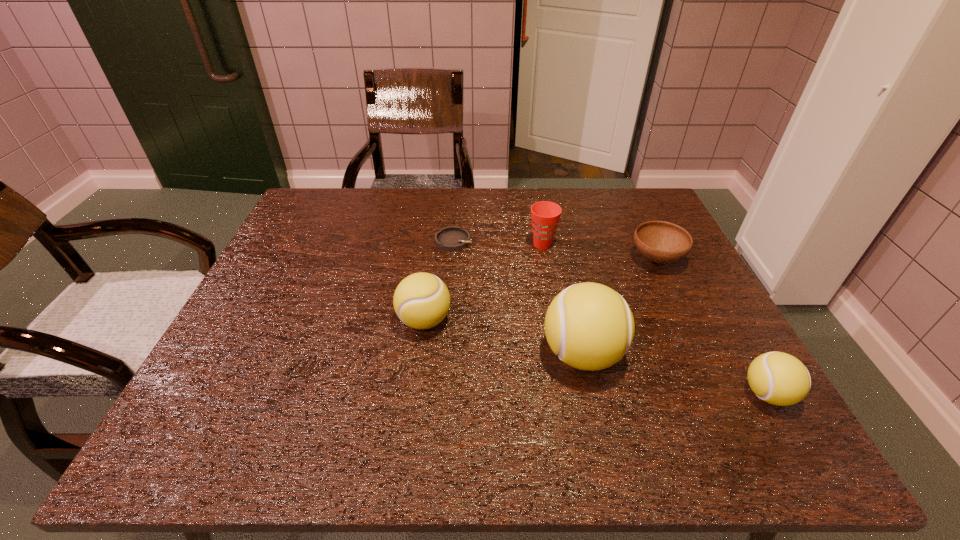
Image resolution: width=960 pixels, height=540 pixels. In order to click on the leftmost tennis ball in this screenshot , I will do `click(421, 301)`.

Identify the location of the tallest tennis ball. The height and width of the screenshot is (540, 960). (590, 326).

Find the location of a particular element. the second tennis ball from left to right is located at coordinates (590, 326).

Identify the location of the shortest tennis ball. (778, 378).

I want to click on the fourth tallest object, so click(x=778, y=378).

This screenshot has width=960, height=540. I want to click on cup, so click(x=545, y=215).

This screenshot has height=540, width=960. Find the location of `the second shortest object`. the second shortest object is located at coordinates (662, 242).

The width and height of the screenshot is (960, 540). In order to click on ashtray in this screenshot , I will do `click(452, 238)`.

The image size is (960, 540). In order to click on vacant space positioned on the left of the leftmost tennis ball in this screenshot , I will do [x=284, y=320].

Where is `vacant space located 0.150m on the left of the tallest tennis ball`? This screenshot has height=540, width=960. vacant space located 0.150m on the left of the tallest tennis ball is located at coordinates pos(470,354).